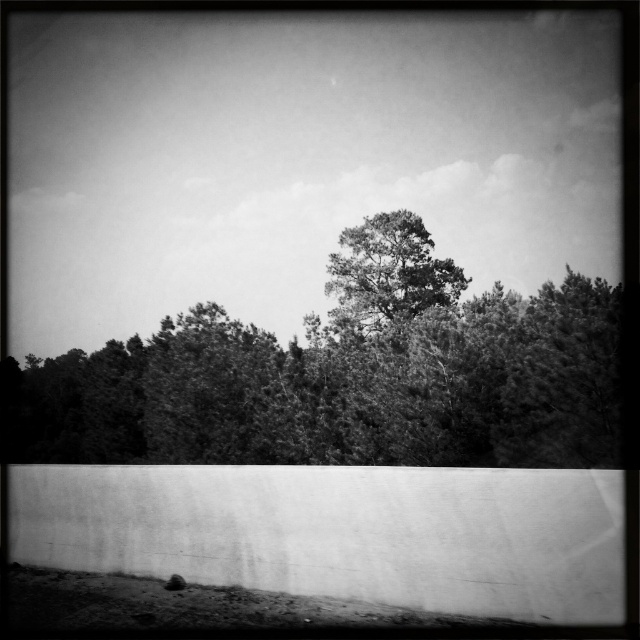
Question: Which point is farther to the camera?

Choices:
 (A) (385, 368)
 (B) (365, 300)

Answer: (B)

Question: Where is dark green textured tree at center located in relation to grainy black tree at center in the image?

Choices:
 (A) below
 (B) above

Answer: (A)

Question: Does dark green textured tree at center have a lesser width compared to grainy black tree at center?

Choices:
 (A) yes
 (B) no

Answer: (B)

Question: Does dark green textured tree at center have a greater width compared to grainy black tree at center?

Choices:
 (A) yes
 (B) no

Answer: (A)

Question: Which of the following is the closest to the observer?

Choices:
 (A) (52, 365)
 (B) (408, 294)

Answer: (A)